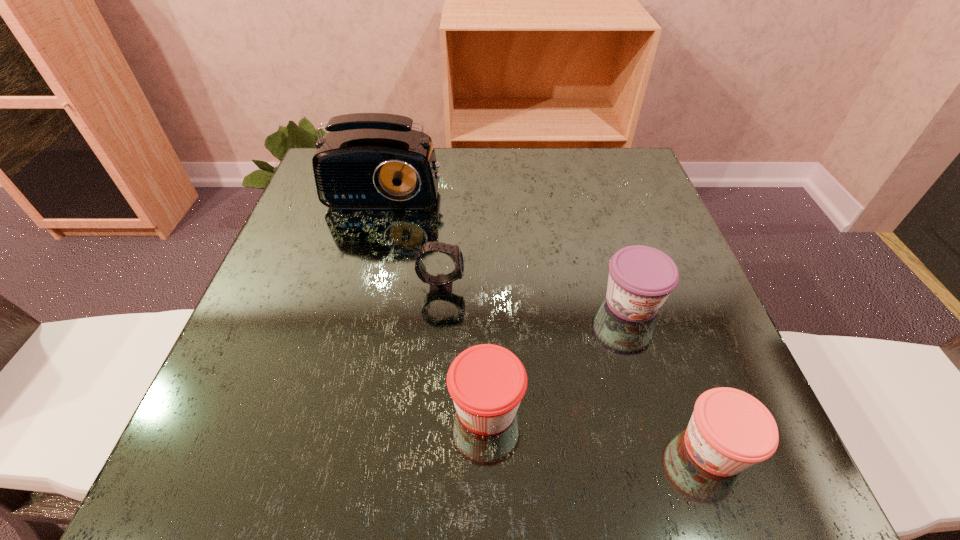
Locate an element on the screen. This screenshot has width=960, height=540. vacant space positioned on the label side of the leftmost jam is located at coordinates (318, 407).

Where is `object located at the far edge`? Image resolution: width=960 pixels, height=540 pixels. object located at the far edge is located at coordinates (366, 160).

You are a GUI agent. You are given a task and a screenshot of the screen. Output one action in this format:
    pyautogui.click(x=<x>, y=<y>)
    Task: Click on the object positioned at the left edge
    The width and height of the screenshot is (960, 540).
    Given the screenshot: What is the action you would take?
    pyautogui.click(x=366, y=160)

Where is `object that is at the far left corner`? object that is at the far left corner is located at coordinates (366, 160).

At what (x,y) coordinates should I click in order to perform the action: click on object positioned at the near right corner. Please return your answer as a coordinate pair (x, y). Looking at the image, I should click on (729, 431).

I want to click on vacant space at the far edge of the desktop, so click(571, 173).

Where is `blank space at the near edge`? blank space at the near edge is located at coordinates (531, 488).

This screenshot has height=540, width=960. Find the location of `vacant space at the left edge`. vacant space at the left edge is located at coordinates (339, 275).

You are a GUI agent. You are given a task and a screenshot of the screen. Output one action in this format:
    pyautogui.click(x=<x>, y=<y>)
    Task: Click on the vacant space at the near left corner
    
    Given the screenshot: What is the action you would take?
    pyautogui.click(x=216, y=450)

In the image, there is a desktop. Where is `vacant space at the far right corner`? The height and width of the screenshot is (540, 960). vacant space at the far right corner is located at coordinates (583, 183).